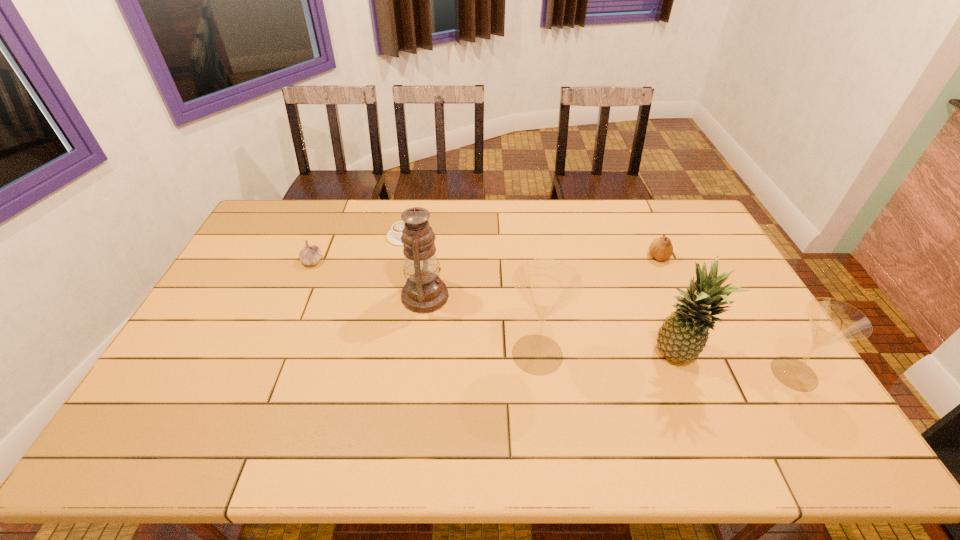
Image resolution: width=960 pixels, height=540 pixels. I want to click on vacant space situated 0.080m on the front of the fifth shortest object, so click(543, 407).

This screenshot has height=540, width=960. What are the coordinates of `free space located 0.090m on the back of the rightmost object` in the screenshot? It's located at (766, 328).

Find the location of a particular element. This screenshot has height=540, width=960. blank space located 0.170m with the handle on the right side of the cappuccino is located at coordinates click(410, 202).

The width and height of the screenshot is (960, 540). In order to click on free region located with the handle on the right side of the cappuccino in this screenshot , I will do `click(407, 218)`.

Locate an element on the screen. Image resolution: width=960 pixels, height=540 pixels. vacant space located 0.050m with the handle on the right side of the cappuccino is located at coordinates click(x=406, y=220).

Where is `vacant point located on the left of the pear`? This screenshot has width=960, height=540. vacant point located on the left of the pear is located at coordinates (536, 257).

The width and height of the screenshot is (960, 540). I want to click on free location located 0.210m on the back of the fourth nearest object, so click(x=433, y=237).

The width and height of the screenshot is (960, 540). Identify the location of vacant point located on the front of the leftmost object. (302, 286).

This screenshot has width=960, height=540. I want to click on free space located 0.110m on the left of the pineapple, so click(x=611, y=357).

Identify the location of object that is at the far edge. (394, 235).